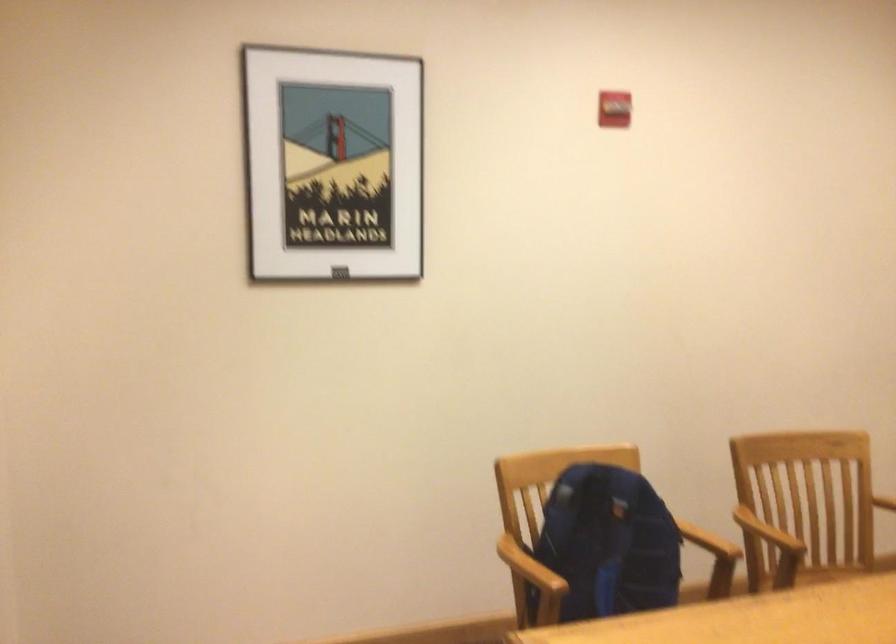
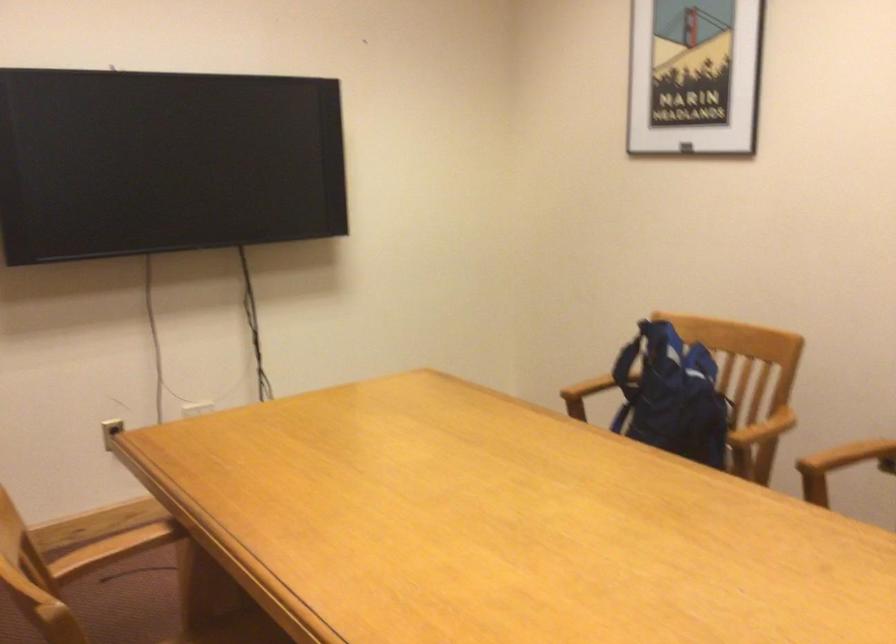
In the second image, find the point that corresponds to the point at 642,536 in the first image.

(672, 395)